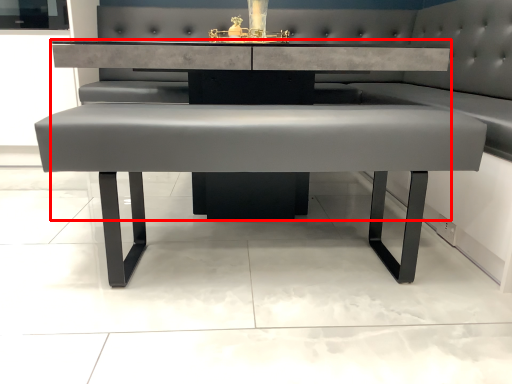
Question: From the image, what is the correct spatial relationship of table (annotated by the red box) in relation to table?

Choices:
 (A) right
 (B) left

Answer: (B)